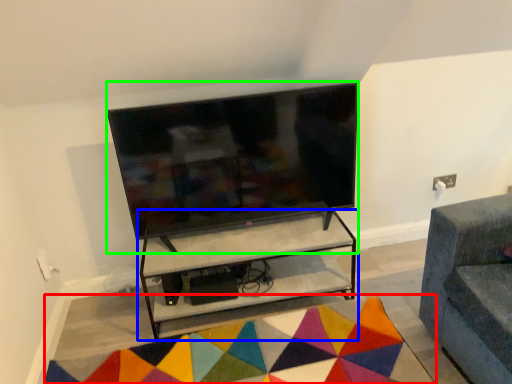
Question: Estimate the real-world distances between objects in this image. Which object is farther from mat (highlighted by a red box), shelf (highlighted by a blue box) or television (highlighted by a green box)?

Choices:
 (A) shelf
 (B) television

Answer: (B)